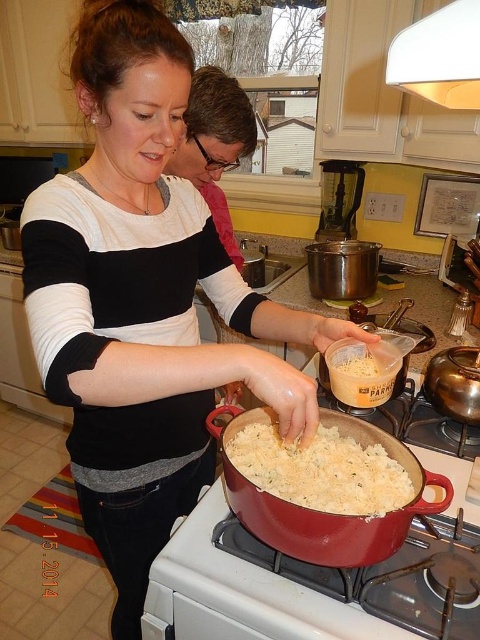
Is white creamy rice at center below white powder container at center?

Yes, white creamy rice at center is below white powder container at center.

Between white creamy rice at center and white powder container at center, which one is positioned higher?

white powder container at center is higher up.

What do you see at coordinates (322, 470) in the screenshot?
I see `white creamy rice at center` at bounding box center [322, 470].

This screenshot has height=640, width=480. I want to click on white creamy rice at center, so click(x=322, y=470).